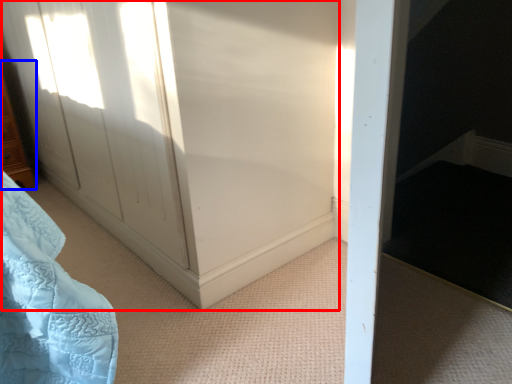
Question: Among these objects, which one is farthest to the camera, screen door (highlighted by a red box) or furniture (highlighted by a blue box)?

Choices:
 (A) screen door
 (B) furniture

Answer: (B)